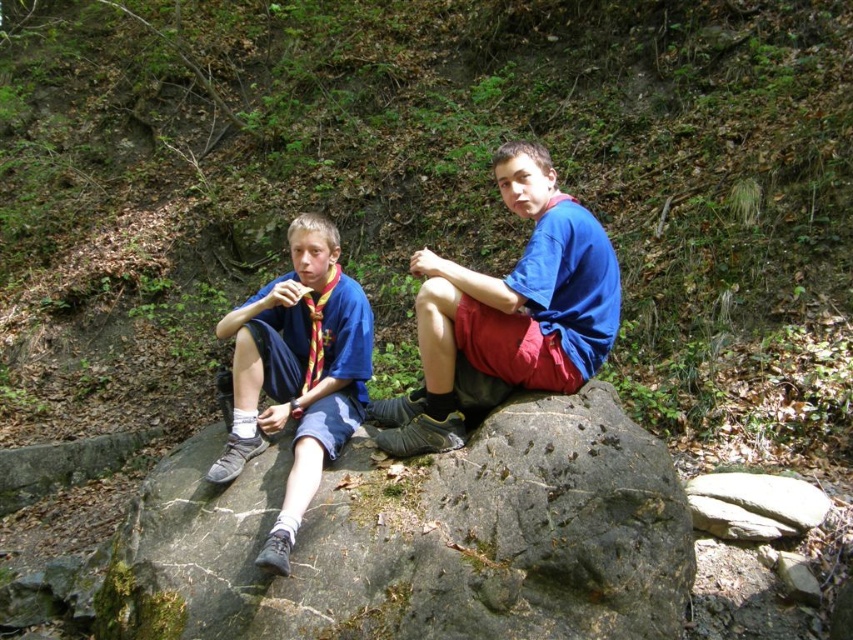
You are planning to place a small picnic basket between the gray rough rock at center and the matte blue shorts at left. Based on their sizes, will the basket fit between them?

The gray rough rock at center is wider than the matte blue shorts at left, so the basket may not fit comfortably between them as the rock takes up more space.

Based on the scene description, where is the gray rough rock at center located in the image?

The gray rough rock at center is located at point 2D coordinates of 0.842 in the x axis and 0.492 in the y axis.